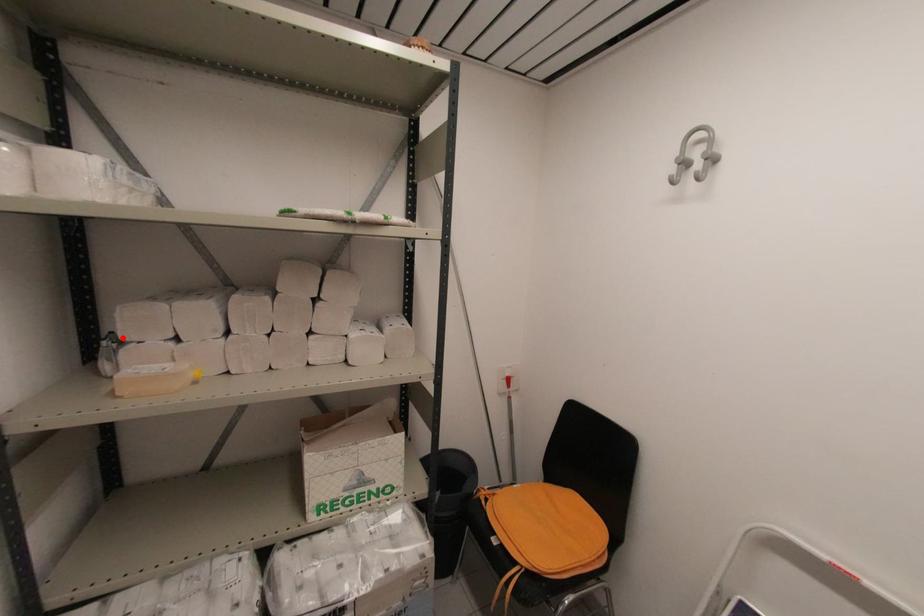
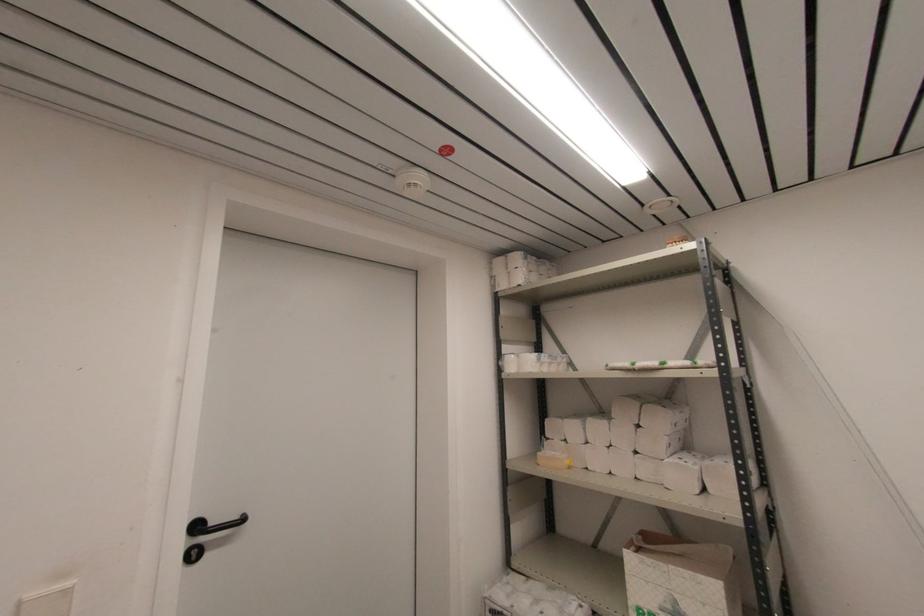
In the second image, find the point that corresponds to the highlighted location in the first image.

(548, 436)